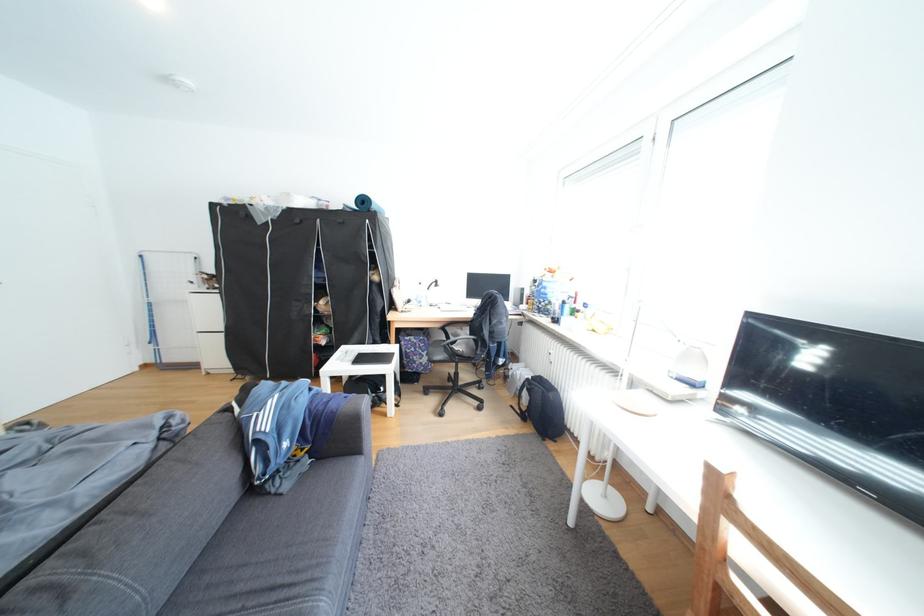
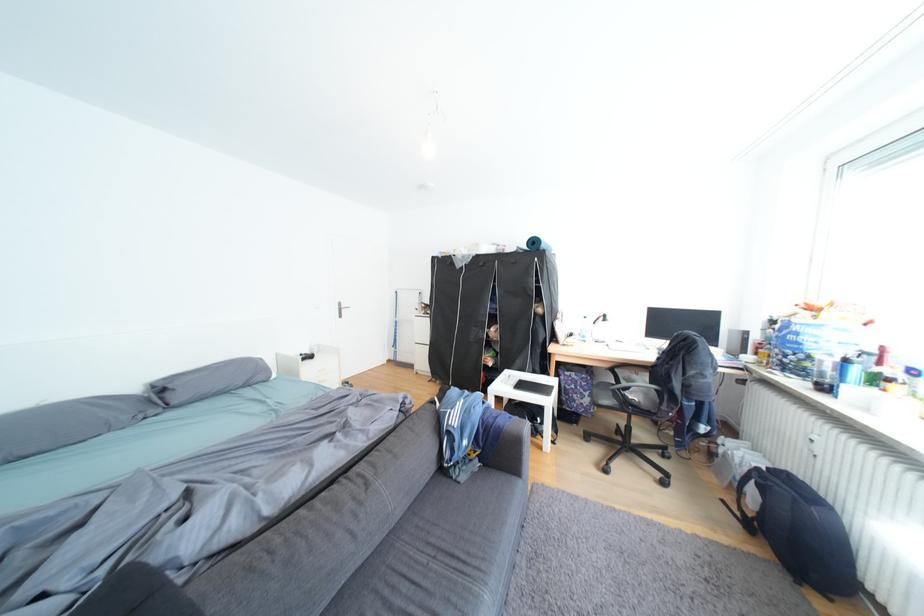
Where in the second image is the point corresponding to [336,344] from the first image?

(504, 365)